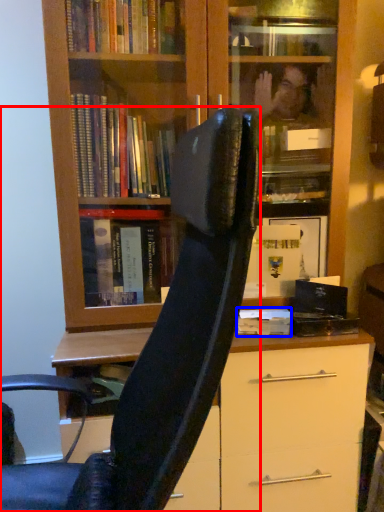
Question: Which object appears farthest to the camera in this image, chair (highlighted by a red box) or paperback book (highlighted by a blue box)?

Choices:
 (A) chair
 (B) paperback book

Answer: (B)